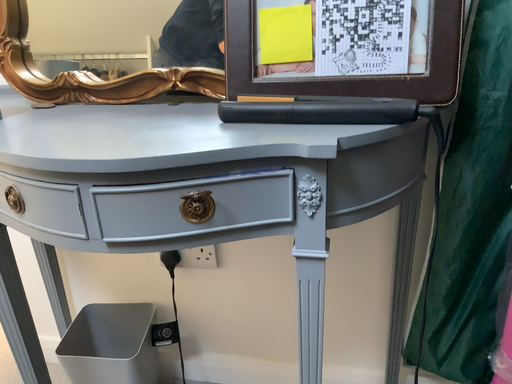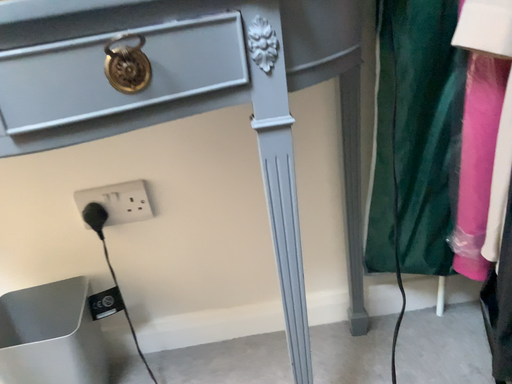
Question: How did the camera likely rotate when shooting the video?

Choices:
 (A) rotated left
 (B) rotated right

Answer: (B)